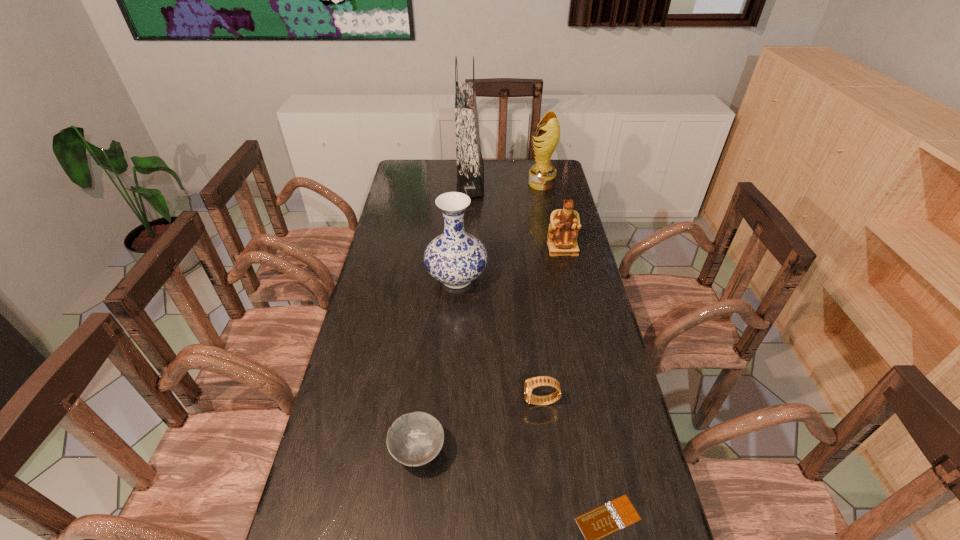
Locate an element on the screen. Image resolution: width=960 pixels, height=540 pixels. vacant space in between the vase and the third farthest object is located at coordinates (510, 264).

At what (x,y) coordinates should I click in order to perform the action: click on object that stands as the closest to the figurine. Please return your answer as a coordinate pair (x, y). Image resolution: width=960 pixels, height=540 pixels. Looking at the image, I should click on (455, 258).

Where is `object that is the sixth closest to the third shortest object`? object that is the sixth closest to the third shortest object is located at coordinates (542, 175).

At what (x,y) coordinates should I click in order to perform the action: click on vacant point that satisfies the following two spatial constraints: 1. on the front-facing side of the award; 2. on the front side of the second shortest object. Please return your answer as a coordinate pair (x, y). Image resolution: width=960 pixels, height=540 pixels. Looking at the image, I should click on (595, 451).